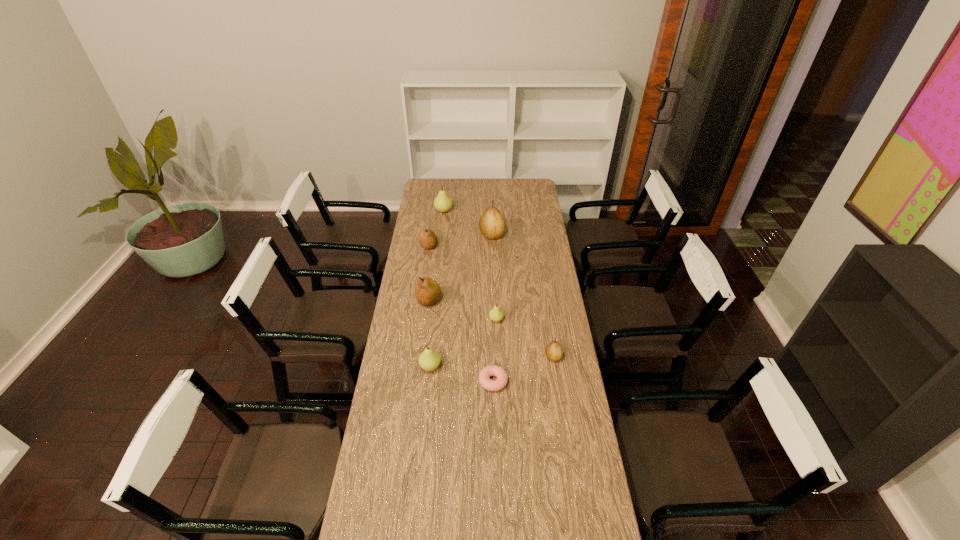
The image size is (960, 540). Identify the location of green pear that can be found as the third closest to the second smallest brown pear. (429, 360).

This screenshot has width=960, height=540. Identify the location of green pear that stands as the second closest to the nearest brown pear. (429, 360).

Where is `vacant area in the image that satisfies the following two spatial constraints: 1. on the back side of the biggest brown pear; 2. on the left side of the fourth farthest pear`? vacant area in the image that satisfies the following two spatial constraints: 1. on the back side of the biggest brown pear; 2. on the left side of the fourth farthest pear is located at coordinates (437, 235).

Locate an element on the screen. This screenshot has height=540, width=960. vacant area in the image that satisfies the following two spatial constraints: 1. on the front side of the third biggest brown pear; 2. on the left side of the nearest brown pear is located at coordinates (414, 357).

Where is `vacant space that satisfies the following two spatial constraints: 1. on the front side of the biggest brown pear; 2. on the right side of the smallest green pear`? This screenshot has width=960, height=540. vacant space that satisfies the following two spatial constraints: 1. on the front side of the biggest brown pear; 2. on the right side of the smallest green pear is located at coordinates pyautogui.click(x=494, y=320).